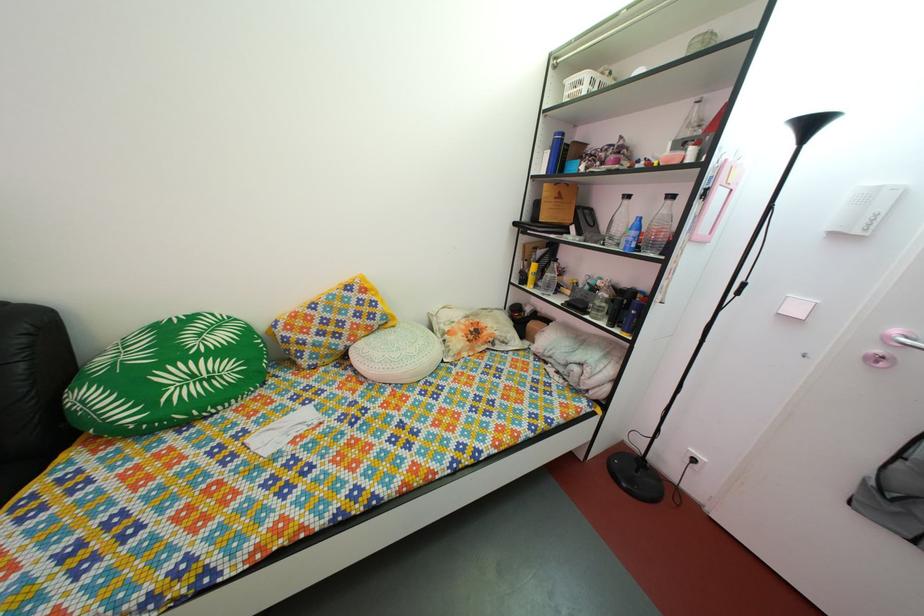
Identify the location of lamp cord switch. Image resolution: width=924 pixels, height=616 pixels. (695, 459).